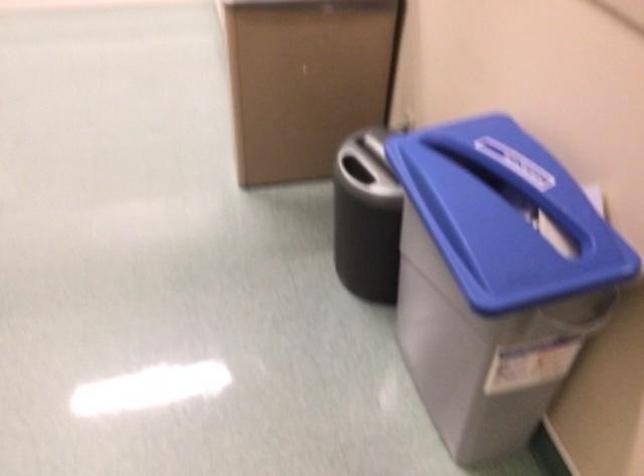
Identify the location of blue bin lid. (504, 214).